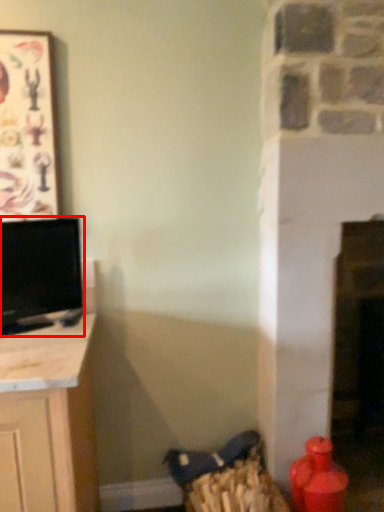
Question: From the image, what is the correct spatial relationship of television (annotated by the red box) in relation to picture frame?

Choices:
 (A) left
 (B) right

Answer: (B)